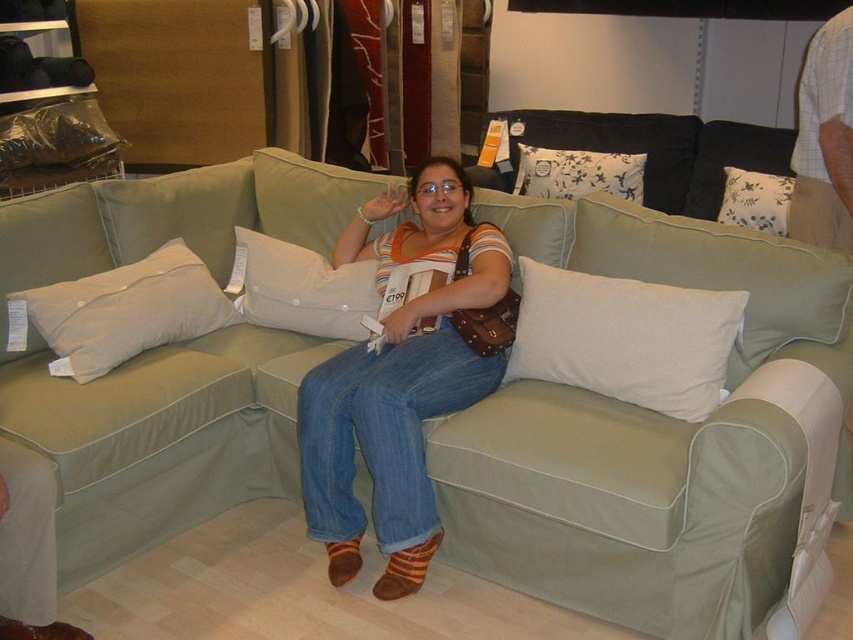
Who is more forward, (412,464) or (334,324)?

Point (412,464)

Identify the location of denim jeans at center. (398, 381).

The height and width of the screenshot is (640, 853). In order to click on denim jeans at center in this screenshot , I will do `click(398, 381)`.

Is point (415, 426) closer to viewer compared to point (91, 292)?

Yes.

Find the location of `denim jeans at center`. denim jeans at center is located at coordinates (398, 381).

Locate an element on the screen. The width and height of the screenshot is (853, 640). denim jeans at center is located at coordinates (398, 381).

Does beige fabric pillow at left have a lesser height compared to white floral fabric pillow at upper right?

In fact, beige fabric pillow at left may be taller than white floral fabric pillow at upper right.

Which of these two, beige fabric pillow at left or white floral fabric pillow at upper right, stands taller?

beige fabric pillow at left is taller.

Is point (119, 305) closer to viewer compared to point (773, 234)?

Yes, it is in front of point (773, 234).

Image resolution: width=853 pixels, height=640 pixels. Identify the location of beige fabric pillow at left. (125, 310).